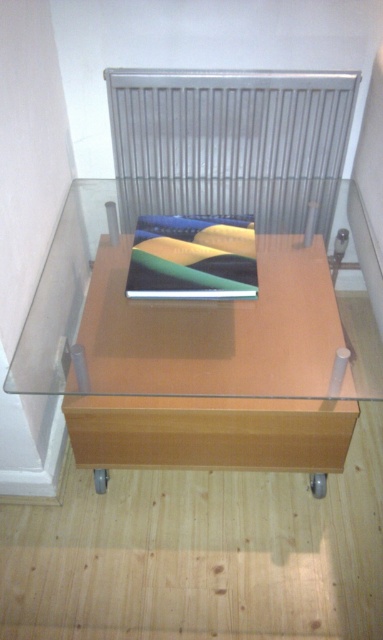
Question: Among these objects, which one is farthest from the camera?

Choices:
 (A) light brown wood table at center
 (B) silver metallic radiator at upper center

Answer: (B)

Question: Does light brown wood table at center have a lesser width compared to silver metallic radiator at upper center?

Choices:
 (A) yes
 (B) no

Answer: (A)

Question: Which point is closer to the camera taking this photo?

Choices:
 (A) (85, 310)
 (B) (147, 195)

Answer: (A)

Question: Can you confirm if light brown wood table at center is positioned to the left of silver metallic radiator at upper center?

Choices:
 (A) no
 (B) yes

Answer: (B)

Question: Does light brown wood table at center appear under silver metallic radiator at upper center?

Choices:
 (A) no
 (B) yes

Answer: (B)